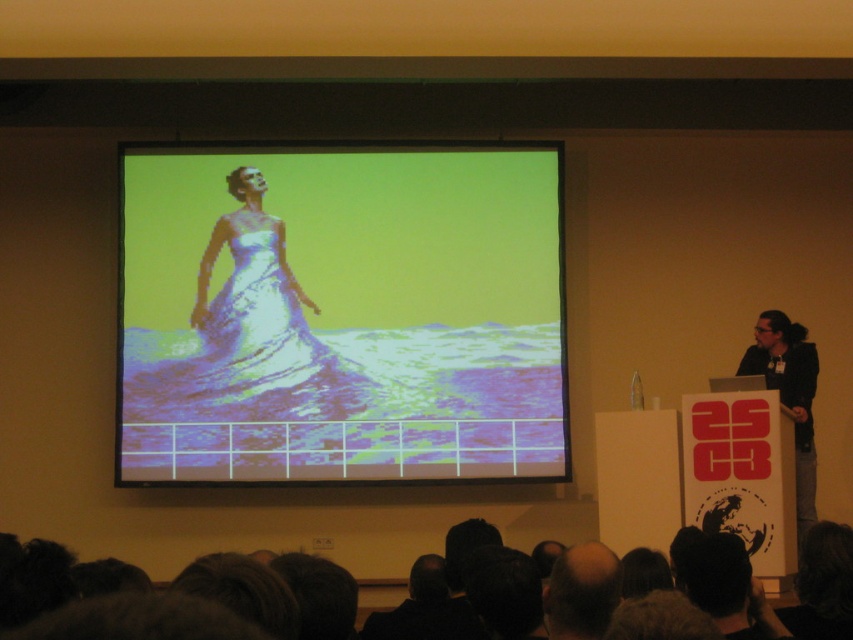
Question: Can you confirm if black fabric at right is positioned to the right of bald head at lower center?

Choices:
 (A) no
 (B) yes

Answer: (B)

Question: Does white glossy dress at upper center appear over black fabric at right?

Choices:
 (A) yes
 (B) no

Answer: (A)

Question: Which is nearer to the white glossy dress at upper center?

Choices:
 (A) bald head at lower center
 (B) black fabric at right

Answer: (B)

Question: Observing the image, what is the correct spatial positioning of white glossy dress at upper center in reference to bald head at lower center?

Choices:
 (A) above
 (B) below

Answer: (A)

Question: Considering the real-world distances, which object is closest to the white glossy dress at center?

Choices:
 (A) black fabric at right
 (B) white glossy dress at upper center

Answer: (B)

Question: Which point is closer to the camera?

Choices:
 (A) (134, 209)
 (B) (300, 291)

Answer: (B)